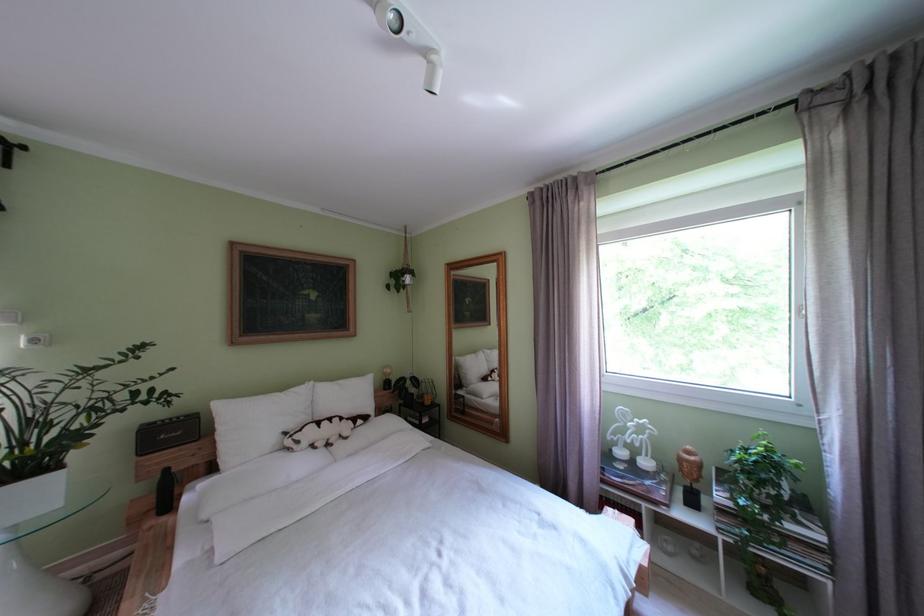
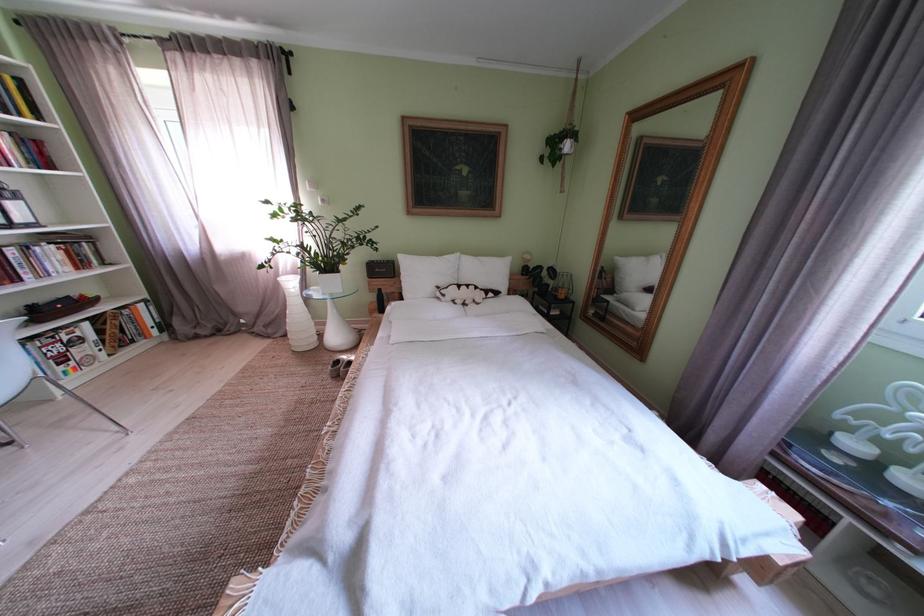
How did the camera likely rotate?

The camera's rotation is toward left-down.